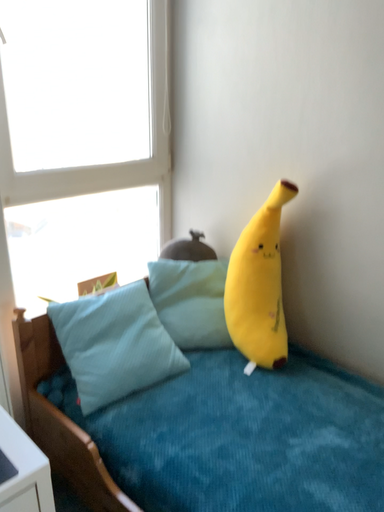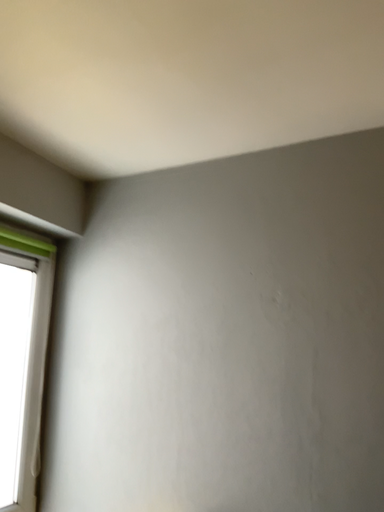
Question: How did the camera likely rotate when shooting the video?

Choices:
 (A) rotated right
 (B) rotated left

Answer: (A)